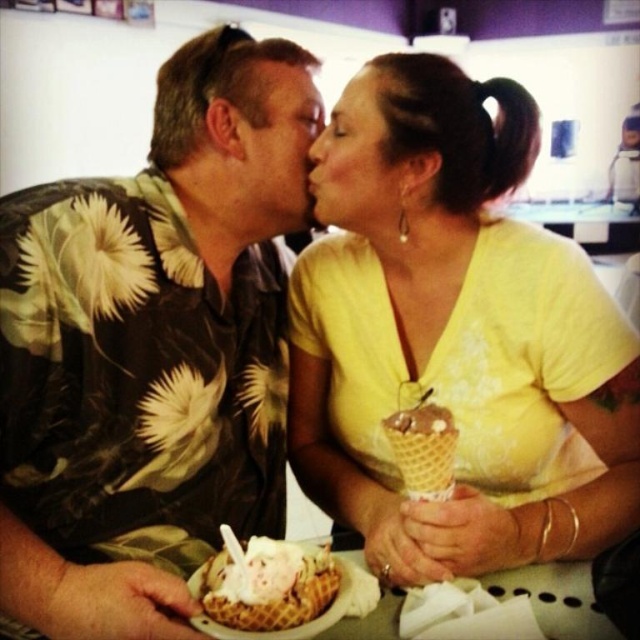
Question: Does matte floral shirt at center appear on the left side of soft pink ice cream at center?

Choices:
 (A) no
 (B) yes

Answer: (B)

Question: Can you confirm if matte yellow shirt at center is positioned to the left of soft pink ice cream at center?

Choices:
 (A) no
 (B) yes

Answer: (A)

Question: Which of the following is the closest to the observer?

Choices:
 (A) soft pink ice cream at center
 (B) matte skin forehead at center

Answer: (A)

Question: Which point appears closest to the camera in this image?

Choices:
 (A) (388, 435)
 (B) (333, 264)

Answer: (A)

Question: Which object is positioned farthest from the matte floral shirt at center?

Choices:
 (A) matte yellow shirt at center
 (B) matte skin forehead at center

Answer: (A)

Question: Does soft pink ice cream at center have a greater width compared to matte skin forehead at center?

Choices:
 (A) yes
 (B) no

Answer: (A)